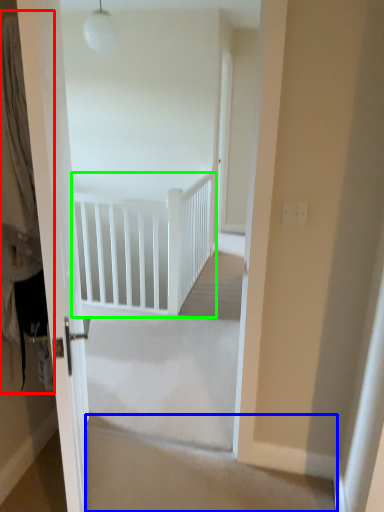
Question: Which object is positioned farthest from curtain (highlighted by a red box)? Select from stairwell (highlighted by a blue box) and rail (highlighted by a green box).

Choices:
 (A) stairwell
 (B) rail

Answer: (B)